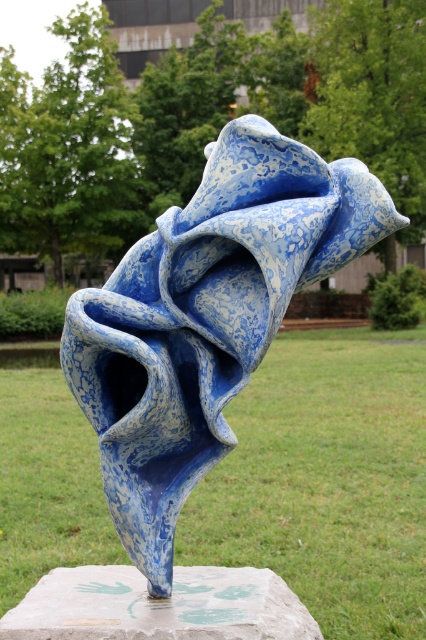
In the scene shown: You are standing in front of the sculpture and notice two points marked on the ground. The first point is at coordinate point (409, 536) and the second is at point (97, 586). If you want to walk from the first point to the second, will you have to walk towards the sculpture or away from it?

The point (409, 536) is behind point (97, 586). Therefore, walking from point (409, 536) to point (97, 586) would mean moving towards the sculpture since you are moving from a position behind to in front of the second point.

You are standing in the park and see the green grass at center and the blue marbled stone sculpture at center. Which object is located higher from the ground?

The blue marbled stone sculpture at center is higher from the ground than the green grass at center because the green grass at center is below it.